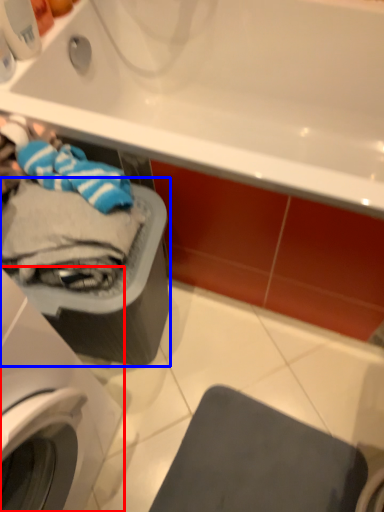
Question: Which object appears farthest to the camera in this image, washing machine (highlighted by a red box) or dish washer (highlighted by a blue box)?

Choices:
 (A) washing machine
 (B) dish washer

Answer: (B)